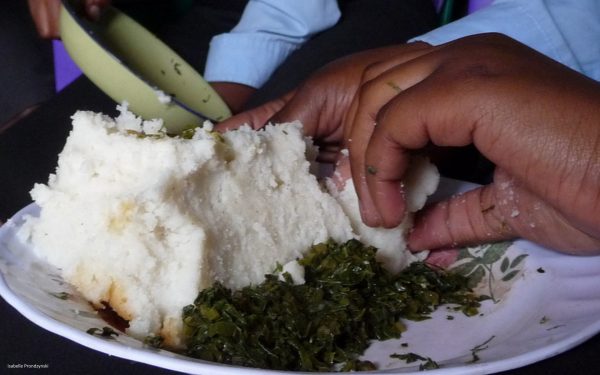
The height and width of the screenshot is (375, 600). Identify the location of yellow plate. (128, 90).